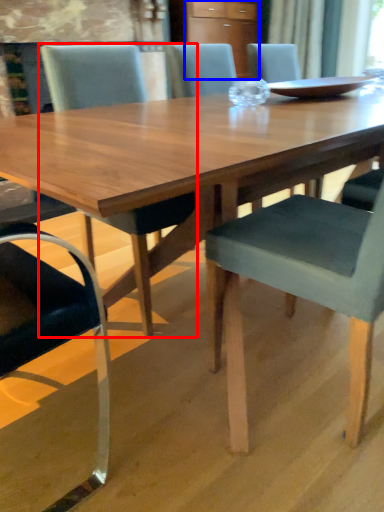
Question: Which of the following is the farthest to the observer, chair (highlighted by a red box) or cabinetry (highlighted by a blue box)?

Choices:
 (A) chair
 (B) cabinetry

Answer: (B)